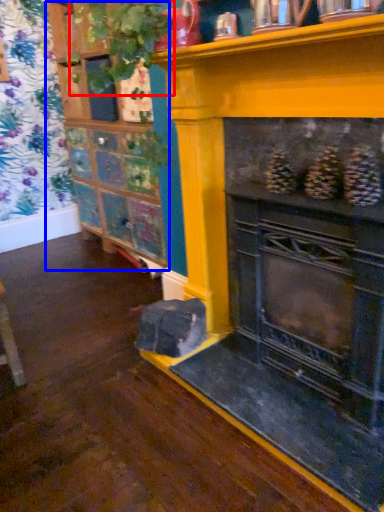
Question: Which point is closer to the camera, plant (highlighted by a red box) or shelf (highlighted by a blue box)?

Choices:
 (A) plant
 (B) shelf

Answer: (B)